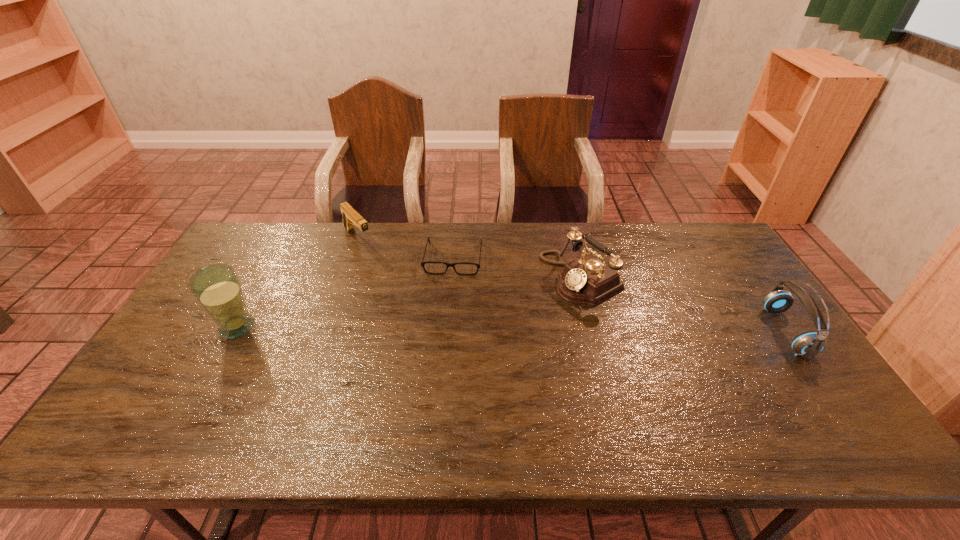
This screenshot has height=540, width=960. Identify the location of free point located on the front-facing side of the shortest object. (441, 343).

In order to click on vacant area situated 0.160m at the barrel of the fourth tallest object in this screenshot , I will do `click(388, 274)`.

Where is `free location located at the barrel of the fourth tallest object`? This screenshot has height=540, width=960. free location located at the barrel of the fourth tallest object is located at coordinates (405, 292).

Locate an element on the screen. The width and height of the screenshot is (960, 540). free spot located at the barrel of the fourth tallest object is located at coordinates (402, 288).

Locate an element on the screen. The image size is (960, 540). vacant space situated 0.220m on the dial of the second object from right to left is located at coordinates (494, 323).

At what (x,y) coordinates should I click in order to perform the action: click on vacant region located on the dial of the second object from right to left. Please return your answer as a coordinate pair (x, y). This screenshot has width=960, height=540. Looking at the image, I should click on (480, 331).

Where is `vacant area situated 0.360m on the dial of the second object from right to left`? vacant area situated 0.360m on the dial of the second object from right to left is located at coordinates (453, 346).

Where is `spectacles at the far edge`? The width and height of the screenshot is (960, 540). spectacles at the far edge is located at coordinates (422, 263).

At what (x,y) coordinates should I click in order to perform the action: click on pistol at the far edge. Please return your answer as a coordinate pair (x, y). Looking at the image, I should click on (350, 217).

This screenshot has height=540, width=960. In order to click on telephone situated at the far edge in this screenshot , I will do `click(587, 280)`.